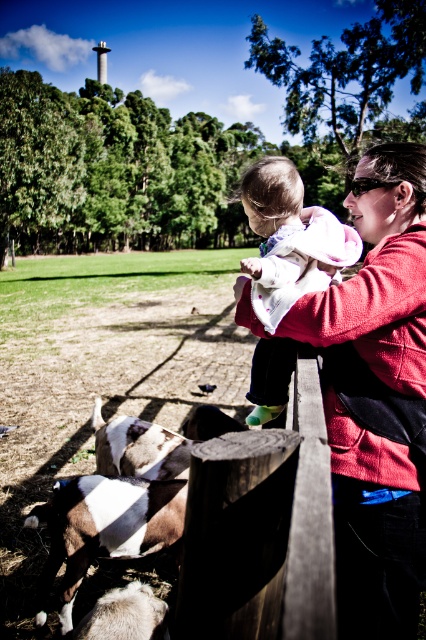
Question: Can you confirm if soft pink fabric baby at center is positioned above white soft fur goat at lower left?

Choices:
 (A) no
 (B) yes

Answer: (B)

Question: Which of the following is the farthest from the observer?

Choices:
 (A) (28, 522)
 (B) (425, 180)
 (C) (279, 164)

Answer: (A)

Question: Considering the relative positions of soft pink fabric baby at center and white soft fur goat at lower left in the image provided, where is soft pink fabric baby at center located with respect to white soft fur goat at lower left?

Choices:
 (A) left
 (B) right

Answer: (B)

Question: Among these points, which one is farthest from the camera?

Choices:
 (A) (256, 228)
 (B) (63, 586)
 (C) (273, 401)

Answer: (C)

Question: Does soft pink fabric baby at center appear on the left side of white soft fur goat at lower left?

Choices:
 (A) yes
 (B) no

Answer: (B)

Question: Which point is closer to the camera taking this photo?

Choices:
 (A) (74, 586)
 (B) (383, 410)
 (C) (284, 390)

Answer: (B)